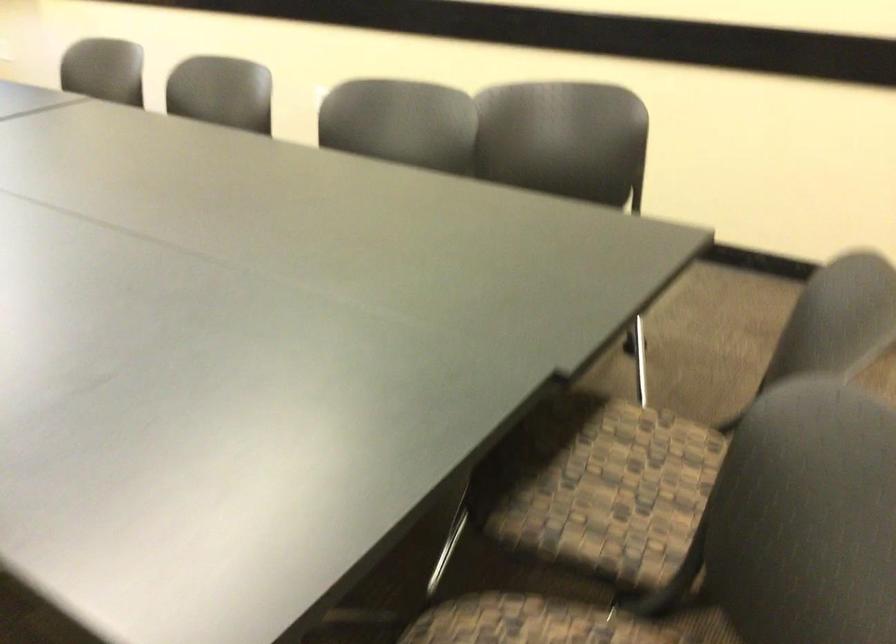
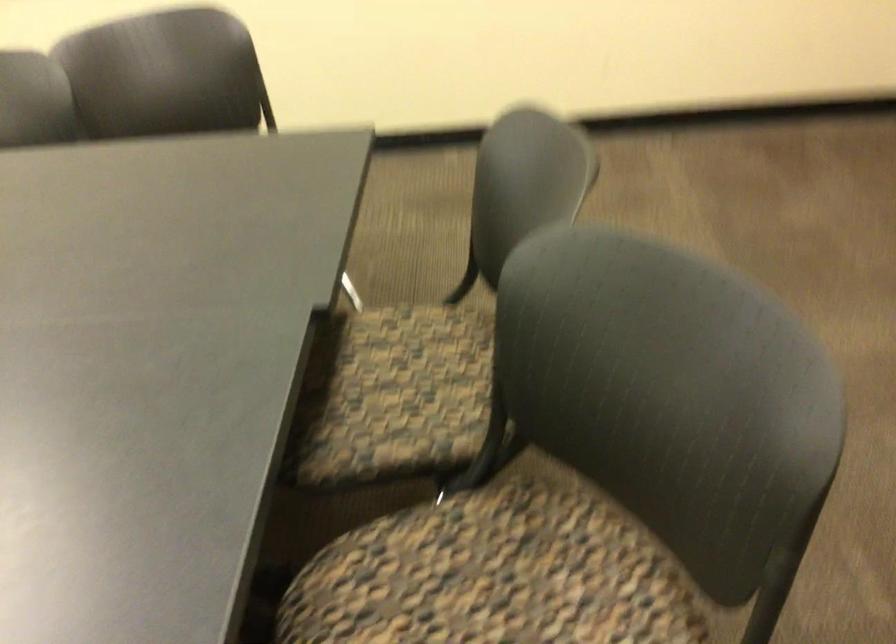
Find the pixel in the second image that matches (639,482) in the first image.

(415, 381)